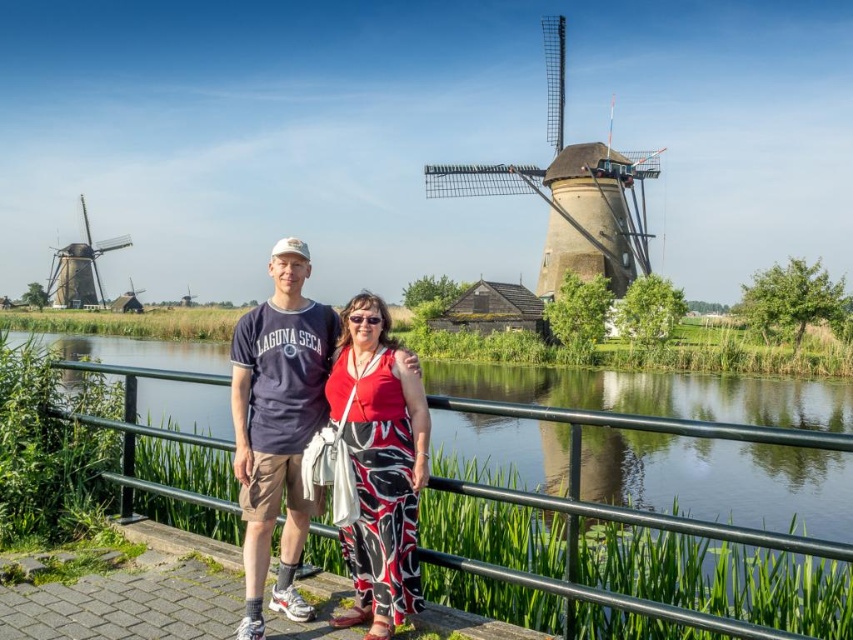
Is green metal railing at center above red printed pants at center?

No.

Which of these two, green metal railing at center or red printed pants at center, stands shorter?

green metal railing at center

Consider the image. Measure the distance between point (573, 596) and camera.

Point (573, 596) and camera are 24.52 meters apart from each other.

The height and width of the screenshot is (640, 853). Find the location of `green metal railing at center`. green metal railing at center is located at coordinates (628, 568).

Between point (426, 560) and point (270, 333), which one is positioned in front?

Point (426, 560) is more forward.

Does green metal railing at center appear on the right side of printed fabric couple at center?

Correct, you'll find green metal railing at center to the right of printed fabric couple at center.

Who is more distant from viewer, [720,614] or [230,381]?

Positioned behind is point [230,381].

Locate an element on the screen. green metal railing at center is located at coordinates (628, 568).

Does point (254, 380) lie behind point (549, 74)?

That is False.

Does printed fabric couple at center have a lesser height compared to wooden windmill at upper right?

Correct, printed fabric couple at center is not as tall as wooden windmill at upper right.

Is point (293, 561) farther from camera compared to point (584, 154)?

No, it is not.

The height and width of the screenshot is (640, 853). Find the location of `printed fabric couple at center`. printed fabric couple at center is located at coordinates (277, 424).